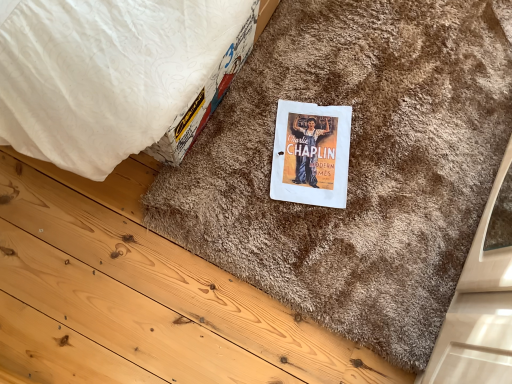
Question: Is brown shaggy doormat at center outside of white paper at center?

Choices:
 (A) no
 (B) yes

Answer: (B)

Question: Does brown shaggy doormat at center have a lesser width compared to white paper at center?

Choices:
 (A) no
 (B) yes

Answer: (A)

Question: Is brown shaggy doormat at center behind white paper at center?

Choices:
 (A) no
 (B) yes

Answer: (A)

Question: Does brown shaggy doormat at center appear on the left side of white paper at center?

Choices:
 (A) yes
 (B) no

Answer: (B)

Question: Does brown shaggy doormat at center have a smaller size compared to white paper at center?

Choices:
 (A) yes
 (B) no

Answer: (B)

Question: Is brown shaggy doormat at center oriented away from white paper at center?

Choices:
 (A) no
 (B) yes

Answer: (A)

Question: From a real-world perspective, is white paper at center beneath brown shaggy doormat at center?

Choices:
 (A) no
 (B) yes

Answer: (B)

Question: Is white paper at center thinner than brown shaggy doormat at center?

Choices:
 (A) no
 (B) yes

Answer: (B)

Question: Does white paper at center have a lesser height compared to brown shaggy doormat at center?

Choices:
 (A) no
 (B) yes

Answer: (B)

Question: Considering the relative sizes of white paper at center and brown shaggy doormat at center in the image provided, is white paper at center bigger than brown shaggy doormat at center?

Choices:
 (A) yes
 (B) no

Answer: (B)

Question: From a real-world perspective, is white paper at center on brown shaggy doormat at center?

Choices:
 (A) no
 (B) yes

Answer: (A)

Question: Is white paper at center not near brown shaggy doormat at center?

Choices:
 (A) yes
 (B) no

Answer: (B)

Question: From the image's perspective, is brown shaggy doormat at center located above or below white paper at center?

Choices:
 (A) below
 (B) above

Answer: (B)